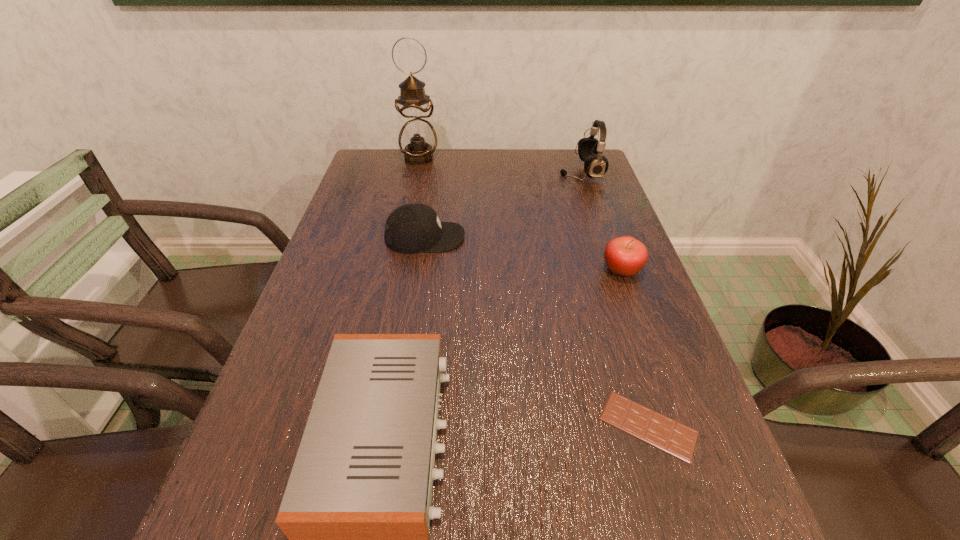
You are a GUI agent. You are given a task and a screenshot of the screen. Output one action in this format:
    pyautogui.click(x=<x>, y=<y>)
    Task: Click on the vacant space located on the front of the apple
    
    Given the screenshot: What is the action you would take?
    pyautogui.click(x=639, y=319)

This screenshot has width=960, height=540. Identify the location of free space located on the left of the shortest object. (529, 426).

I want to click on oil lamp that is at the far edge, so click(x=417, y=136).

This screenshot has width=960, height=540. In order to click on headset at the far edge in this screenshot , I will do `click(590, 150)`.

Image resolution: width=960 pixels, height=540 pixels. In order to click on oil lamp situated at the left edge in this screenshot , I will do `click(417, 136)`.

This screenshot has width=960, height=540. In order to click on cap situated at the left edge in this screenshot , I will do `click(412, 228)`.

This screenshot has height=540, width=960. I want to click on headset located in the right edge section of the desktop, so click(590, 150).

Find the location of a particular element. The width and height of the screenshot is (960, 540). apple that is at the right edge is located at coordinates (625, 256).

Identify the location of chocolate bar that is at the right edge. (662, 432).

You are a GUI agent. You are given a task and a screenshot of the screen. Output one action in this format:
    pyautogui.click(x=<x>, y=<y>)
    Task: Click on the object located in the far left corner section of the desktop
    The image size is (960, 540).
    Given the screenshot: What is the action you would take?
    pyautogui.click(x=417, y=136)